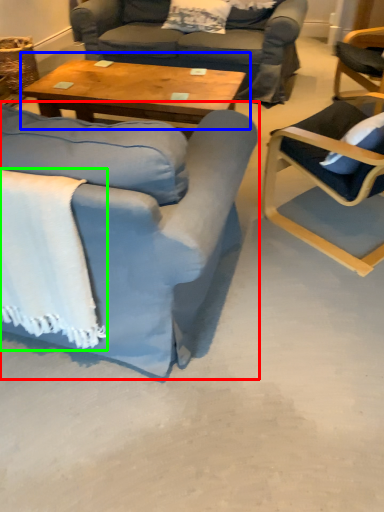
Question: Based on their relative distances, which object is nearer to chair (highlighted by a red box)? Choose from coffee table (highlighted by a blue box) and blanket (highlighted by a green box).

Choices:
 (A) coffee table
 (B) blanket

Answer: (B)